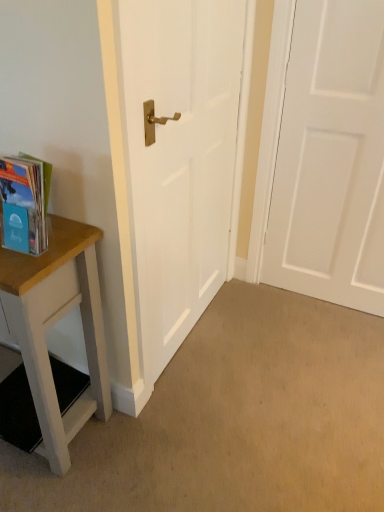
Locate an element on the screen. Image resolution: width=384 pixels, height=512 pixels. free spot below white matte door at right, which is the 1th door from right to left (from a real-world perspective) is located at coordinates (318, 306).